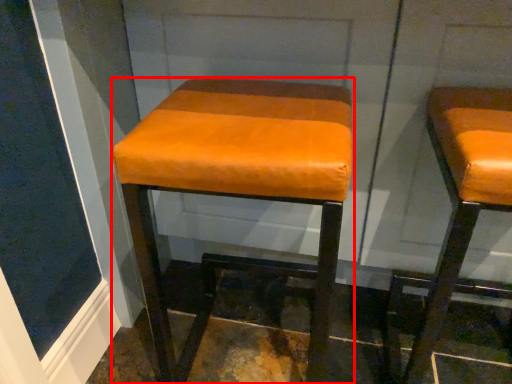
Question: From the image's perspective, considering the relative positions of stool (annotated by the red box) and stool in the image provided, where is stool (annotated by the red box) located with respect to the staircase?

Choices:
 (A) above
 (B) below

Answer: (A)